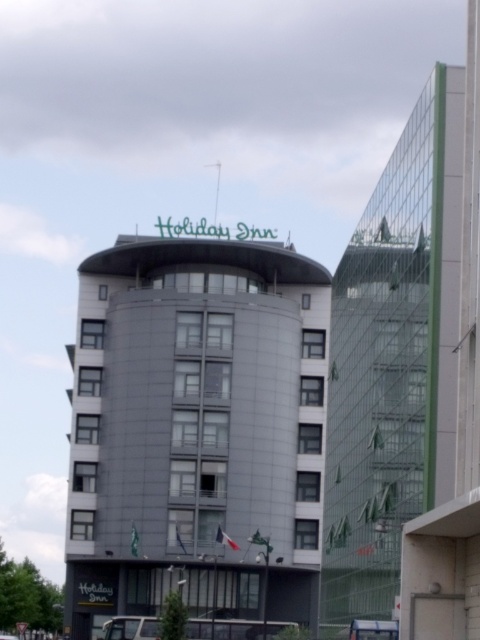
Question: Among these points, which one is nearest to the camera?

Choices:
 (A) (220, 333)
 (B) (389, 604)

Answer: (B)

Question: Which of the following is the farthest from the observer?

Choices:
 (A) gray concrete building at center
 (B) green glass building at right

Answer: (A)

Question: Is gray concrete building at center smaller than green glass building at right?

Choices:
 (A) yes
 (B) no

Answer: (B)

Question: Does gray concrete building at center appear over green glass building at right?

Choices:
 (A) yes
 (B) no

Answer: (B)

Question: Can you confirm if gray concrete building at center is positioned to the right of green glass building at right?

Choices:
 (A) yes
 (B) no

Answer: (B)